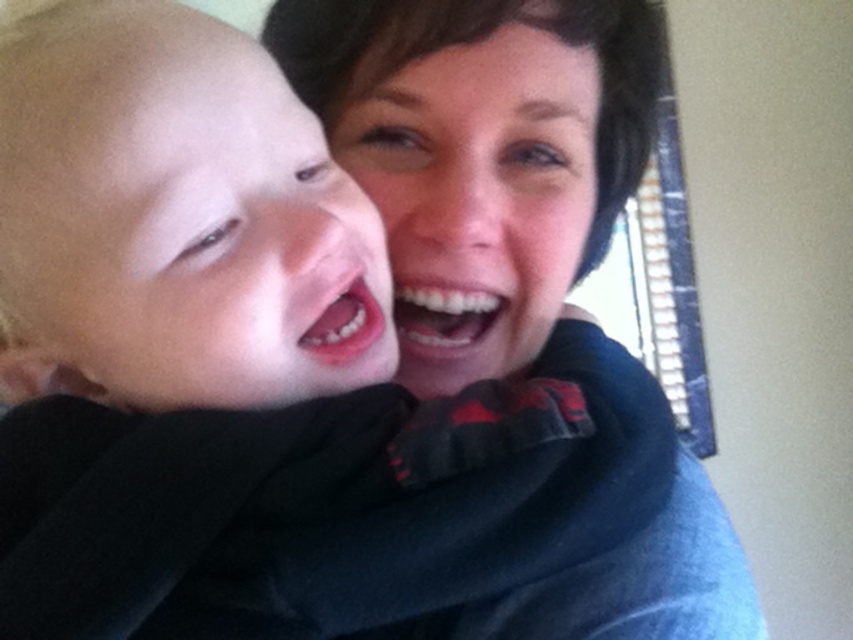
Question: Among these points, which one is farthest from the camera?

Choices:
 (A) (138, 173)
 (B) (486, 616)
 (C) (405, 176)

Answer: (C)

Question: Considering the real-world distances, which object is farthest from the matte black scarf at center?

Choices:
 (A) matte black sweater at upper center
 (B) smooth skin face at left

Answer: (B)

Question: Is smooth skin baby at left positioned in front of matte black scarf at center?

Choices:
 (A) no
 (B) yes

Answer: (B)

Question: Which object is the farthest from the matte black sweater at upper center?

Choices:
 (A) smooth skin face at left
 (B) matte black scarf at center
 (C) smooth skin baby at left

Answer: (A)

Question: Does matte black sweater at upper center appear on the right side of smooth skin face at left?

Choices:
 (A) yes
 (B) no

Answer: (A)

Question: Does matte black sweater at upper center appear on the left side of matte black scarf at center?

Choices:
 (A) no
 (B) yes

Answer: (A)